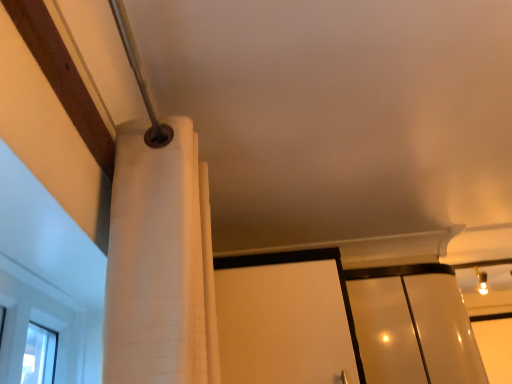
Measure the distance between glossy white cabinet at lower right and camera.

A distance of 1.56 meters exists between glossy white cabinet at lower right and camera.

Image resolution: width=512 pixels, height=384 pixels. What do you see at coordinates (413, 325) in the screenshot?
I see `glossy white cabinet at lower right` at bounding box center [413, 325].

Locate an element on the screen. This screenshot has height=384, width=512. glossy white cabinet at lower right is located at coordinates (413, 325).

In order to click on glossy white cabinet at lower right in this screenshot , I will do `click(413, 325)`.